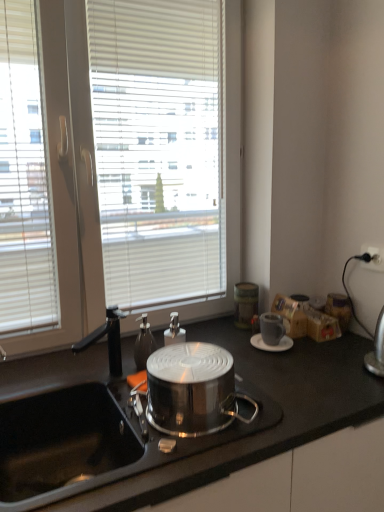
Identify the location of vacant space in front of wooden spice rack at right. Image resolution: width=384 pixels, height=512 pixels. (342, 348).